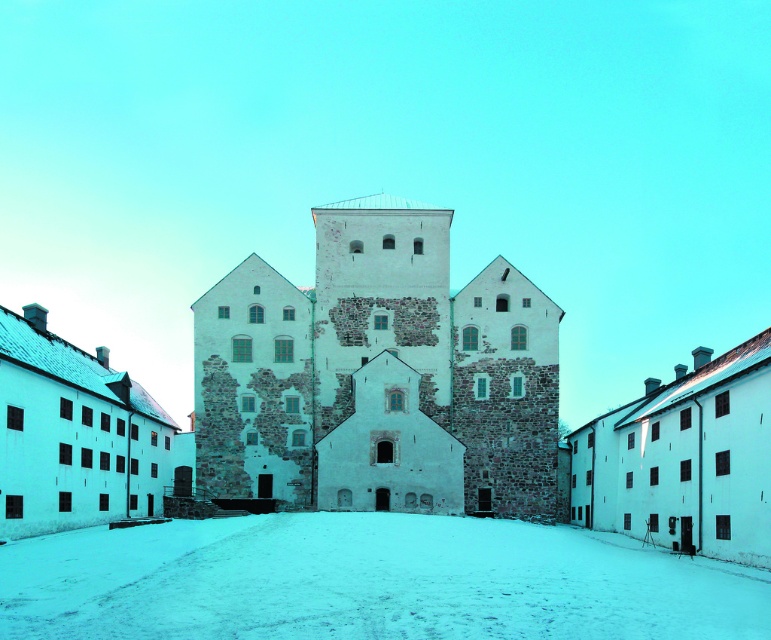
Between white stone tower at center and white powdery snow at center, which one has more height?

white stone tower at center

Between white stone tower at center and white powdery snow at center, which one appears on the left side from the viewer's perspective?

white powdery snow at center

Who is more forward, (332, 314) or (455, 541)?

Point (455, 541) is more forward.

This screenshot has width=771, height=640. I want to click on white stone tower at center, so click(379, 376).